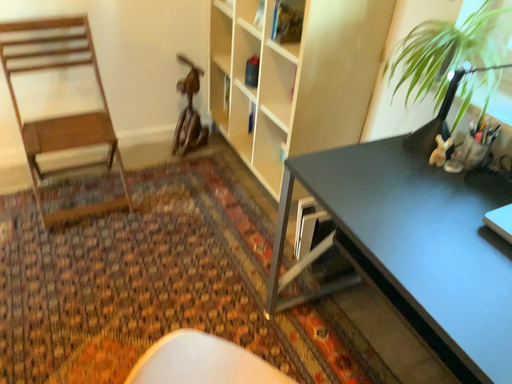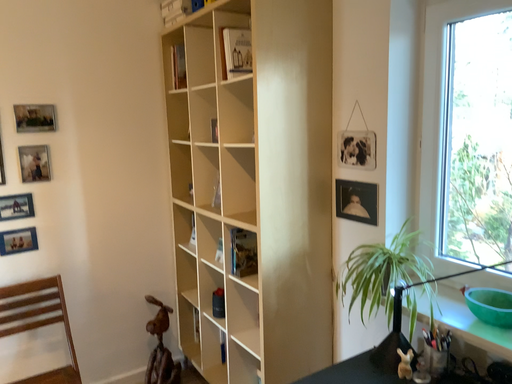
Question: Which way did the camera rotate in the video?

Choices:
 (A) rotated upward
 (B) rotated downward

Answer: (A)